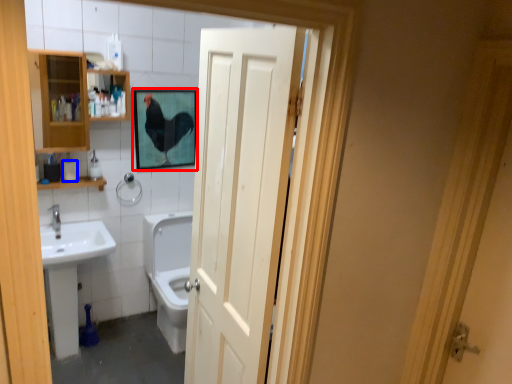
Question: Which of the following is the farthest to the observer, picture frame (highlighted by a red box) or toilet paper (highlighted by a blue box)?

Choices:
 (A) picture frame
 (B) toilet paper

Answer: (A)